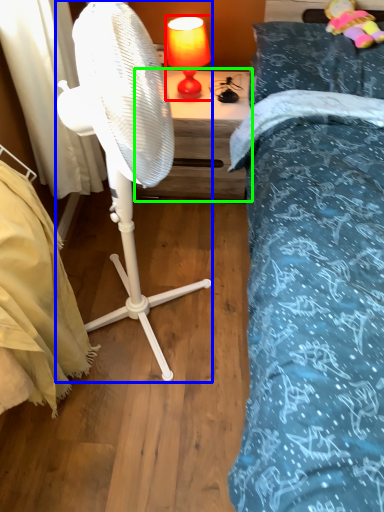
Question: Which object is positioned closest to table lamp (highlighted by a red box)? Select from mechanical fan (highlighted by a blue box) and nightstand (highlighted by a green box).

Choices:
 (A) mechanical fan
 (B) nightstand

Answer: (B)